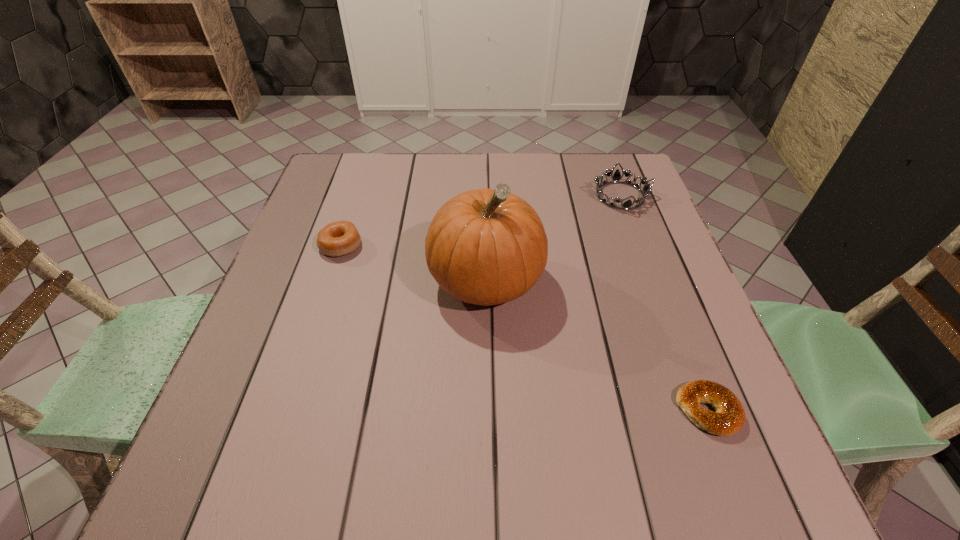
Identify the location of vacant space that's between the farther bagel and the shorter bagel. (524, 328).

Image resolution: width=960 pixels, height=540 pixels. I want to click on unoccupied position between the second object from left to right and the right bagel, so click(x=597, y=346).

Find the location of `free spot between the third shortest object and the third object from right to left`. free spot between the third shortest object and the third object from right to left is located at coordinates (553, 239).

Find the location of `empty location between the farthest object and the nearest object`. empty location between the farthest object and the nearest object is located at coordinates (664, 303).

You are a GUI agent. You are given a task and a screenshot of the screen. Output one action in this format:
    pyautogui.click(x=<x>, y=<y>)
    Task: Click on the object that is the third closest to the shortest object
    The height and width of the screenshot is (540, 960).
    Given the screenshot: What is the action you would take?
    pyautogui.click(x=339, y=238)

Where is `object that is the second closest to the third tallest object`? object that is the second closest to the third tallest object is located at coordinates (616, 177).

At what (x,y) coordinates should I click in order to perform the action: click on vacant space that satisfies the following two spatial constraints: 1. on the stem of the pumpkin; 2. on the right side of the shorter bagel. Please return your answer as a coordinate pair (x, y). Looking at the image, I should click on (488, 410).

Find the location of `vacant point that satisfies the following two spatial constraints: 1. on the stem of the third object from right to left; 2. on the right side of the nearer bagel`. vacant point that satisfies the following two spatial constraints: 1. on the stem of the third object from right to left; 2. on the right side of the nearer bagel is located at coordinates (488, 410).

Find the location of a particular element. The height and width of the screenshot is (540, 960). free region that satisfies the following two spatial constraints: 1. on the front-facing side of the tiara; 2. on the right side of the nearer bagel is located at coordinates (700, 410).

The width and height of the screenshot is (960, 540). Find the location of `vacant space that satisfies the following two spatial constraints: 1. on the stem of the right bagel; 2. on the left side of the second object from left to right`. vacant space that satisfies the following two spatial constraints: 1. on the stem of the right bagel; 2. on the left side of the second object from left to right is located at coordinates (488, 410).